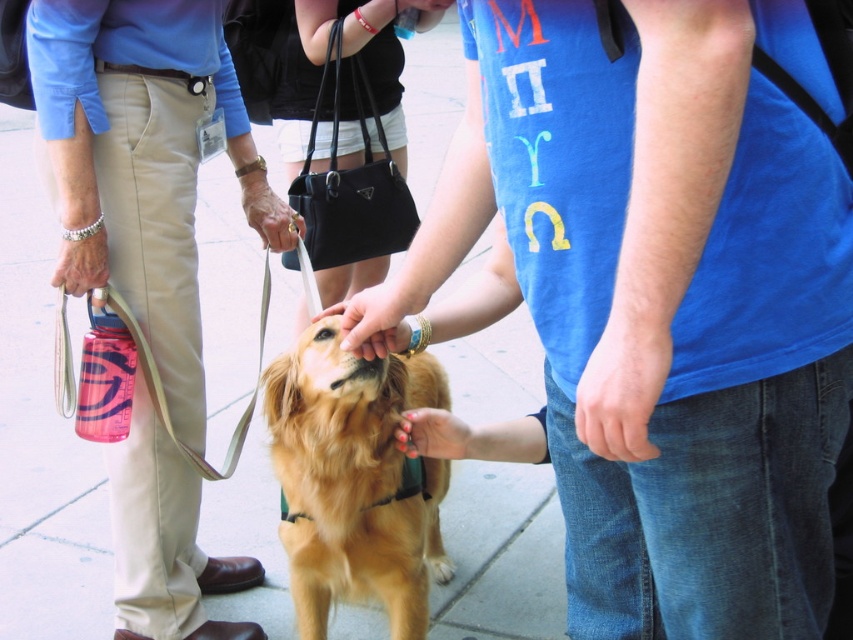
Question: Observing the image, what is the correct spatial positioning of blue cotton t-shirt at center in reference to black leather handbag at center?

Choices:
 (A) left
 (B) right

Answer: (B)

Question: Which object is positioned closest to the black leather handbag at center?

Choices:
 (A) blue cotton t-shirt at center
 (B) golden fur dog at center
 (C) khaki pants at center

Answer: (C)

Question: Which object appears closest to the camera in this image?

Choices:
 (A) khaki pants at center
 (B) black leather handbag at center

Answer: (A)

Question: Considering the relative positions of khaki pants at center and black leather handbag at center in the image provided, where is khaki pants at center located with respect to black leather handbag at center?

Choices:
 (A) below
 (B) above

Answer: (A)

Question: Which of the following is the closest to the observer?

Choices:
 (A) khaki pants at center
 (B) golden fur dog at center

Answer: (B)

Question: Is golden fur dog at center positioned before black leather handbag at center?

Choices:
 (A) no
 (B) yes

Answer: (B)